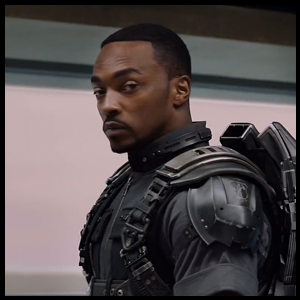
The height and width of the screenshot is (300, 300). In order to click on green and blue border near the ceiling in this screenshot , I will do `click(230, 82)`.